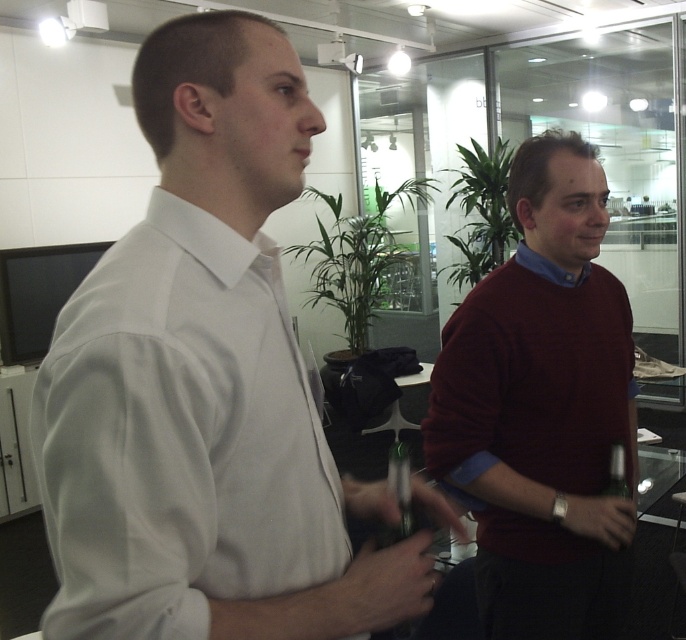
Question: Considering the relative positions of white smooth shirt at center and maroon sweater at right in the image provided, where is white smooth shirt at center located with respect to maroon sweater at right?

Choices:
 (A) below
 (B) above

Answer: (B)

Question: Can you confirm if white smooth shirt at center is positioned to the left of maroon sweater at right?

Choices:
 (A) yes
 (B) no

Answer: (A)

Question: Which of the following is the closest to the observer?

Choices:
 (A) (517, 248)
 (B) (270, 593)

Answer: (B)

Question: Can you confirm if white smooth shirt at center is bigger than maroon sweater at right?

Choices:
 (A) no
 (B) yes

Answer: (A)